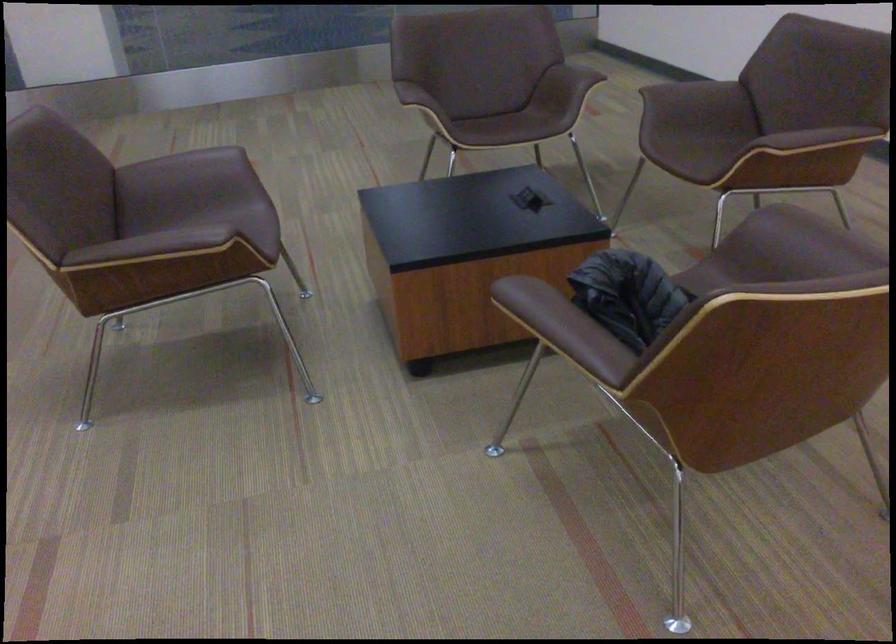
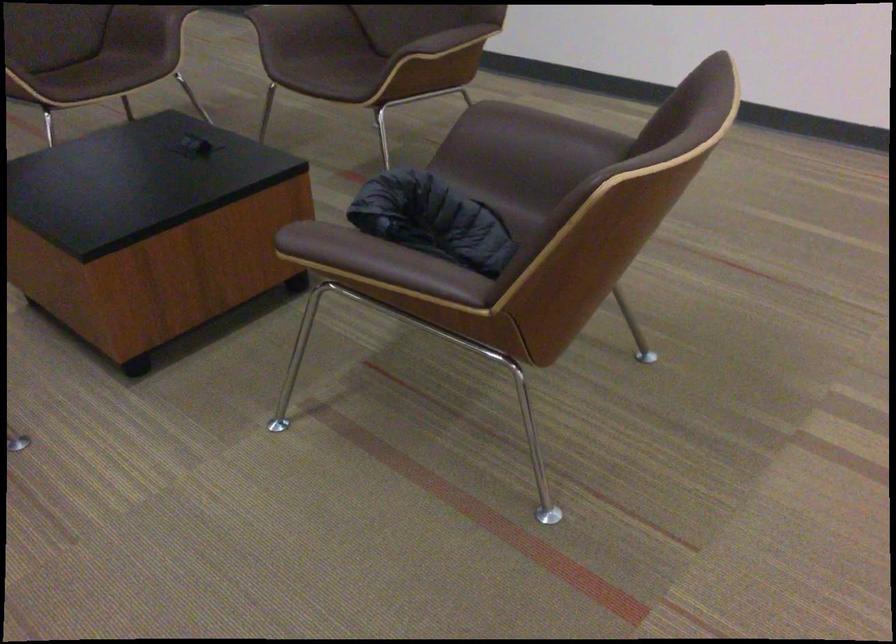
Where in the second image is the point corresponding to point (707, 143) from the first image?

(343, 70)